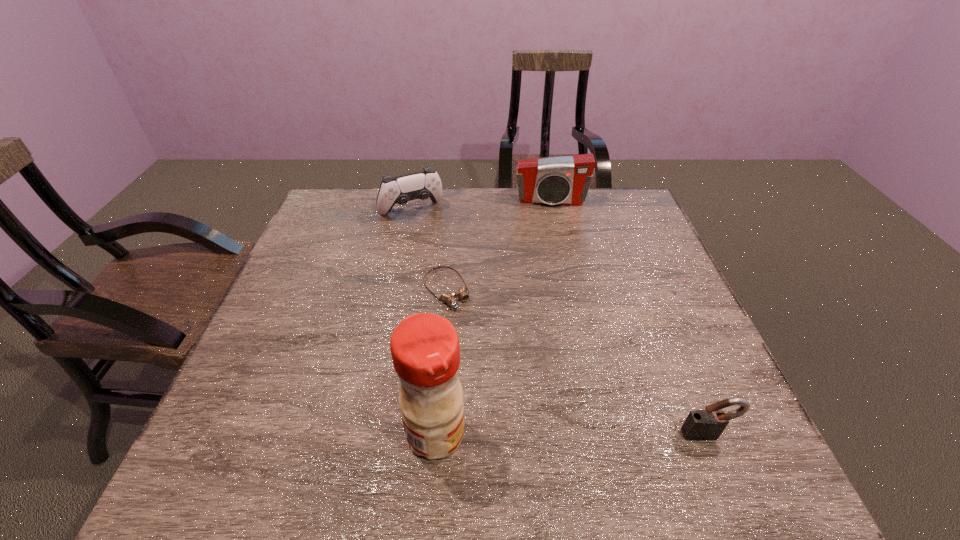
The image size is (960, 540). Find the location of `the tallest object`. the tallest object is located at coordinates pyautogui.click(x=425, y=350).

Identify the location of padlock. (700, 425).

Where is `the fourth tallest object`? This screenshot has width=960, height=540. the fourth tallest object is located at coordinates (700, 425).

The height and width of the screenshot is (540, 960). In order to click on the third farthest object in this screenshot , I will do `click(448, 298)`.

Image resolution: width=960 pixels, height=540 pixels. What are the coordinates of `the shortest object` in the screenshot? It's located at (448, 298).

In order to click on control in this screenshot , I will do `click(420, 185)`.

The height and width of the screenshot is (540, 960). What are the coordinates of `camera` in the screenshot? It's located at (563, 180).

At what (x,y) coordinates should I click in order to perform the action: click on blank space located 0.380m on the back of the tallest object. Please return your answer as a coordinate pair (x, y). The image size is (960, 540). Looking at the image, I should click on (447, 280).

You are a GUI agent. You are given a task and a screenshot of the screen. Output one action in this format:
    pyautogui.click(x=<x>, y=<y>)
    Task: Click on the vacant space located on the front lenses and sides of the third nearest object
    
    Given the screenshot: What is the action you would take?
    pyautogui.click(x=538, y=412)

I want to click on vacant point located on the front lenses and sides of the third nearest object, so click(531, 404).